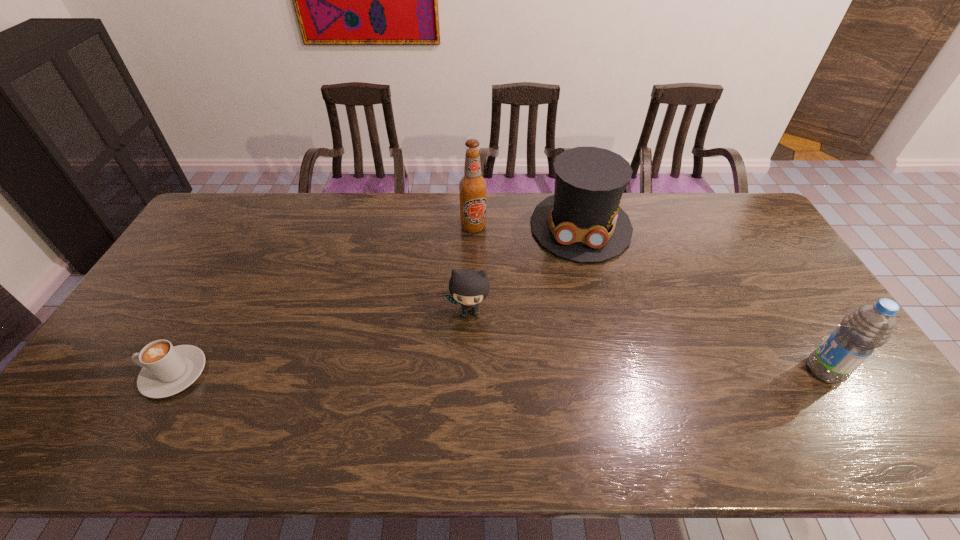
Where is `cappuccino`? cappuccino is located at coordinates 167,370.

At what (x,y) coordinates should I click in order to perform the action: click on the shortest object. Please return your answer as a coordinate pair (x, y). Looking at the image, I should click on pos(167,370).

The width and height of the screenshot is (960, 540). I want to click on water bottle, so click(870, 326).

Find the location of a particular element. This screenshot has width=960, height=540. the tallest object is located at coordinates (472, 186).

Locate an element on the screen. The width and height of the screenshot is (960, 540). dress hat is located at coordinates (582, 221).

In order to click on kitten in this screenshot , I will do `click(468, 287)`.

I want to click on the fourth tallest object, so click(x=468, y=287).

You are a GUI agent. You are given a task and a screenshot of the screen. Output one action in this format:
    pyautogui.click(x=<x>, y=<y>)
    Task: Click on the vacant point located 0.100m to the right of the cappuccino
    This screenshot has width=960, height=540.
    Given the screenshot: What is the action you would take?
    pyautogui.click(x=105, y=373)

At what (x,y) coordinates should I click in order to perform the action: click on free space located on the back of the water bottle. Please return your answer as a coordinate pair (x, y). The image size is (960, 540). Looking at the image, I should click on (799, 328).

Where is `vacant space located on the front label of the tallest object`? vacant space located on the front label of the tallest object is located at coordinates (481, 286).